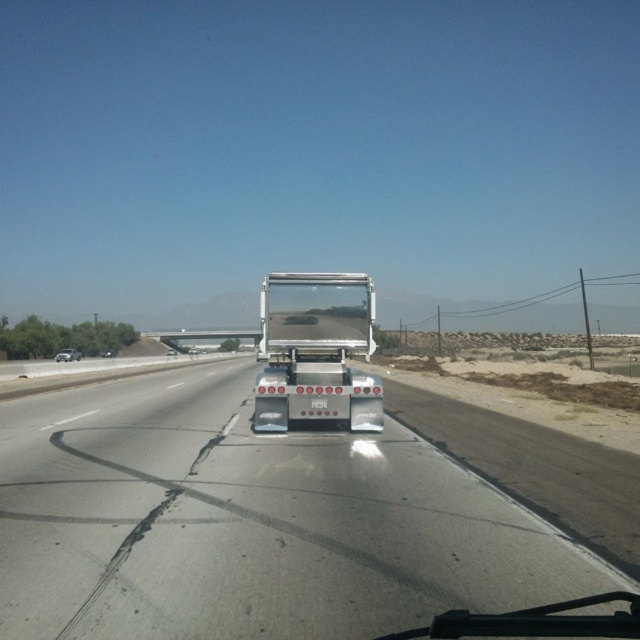
You are a passenger in the vehicle and want to see the silver metallic sedan at left through the transparent glass windshield at center. Can you see the entire sedan through the windshield?

The transparent glass windshield at center has a smaller size compared to silver metallic sedan at left, so you cannot see the entire sedan through the windshield.

You are a passenger in the vehicle and want to know if the point at coordinates point (x=369, y=323) is closer to you than the point at point (x=56, y=358). Can you determine this based on the scene?

Yes, the point at coordinates point (x=369, y=323) is closer to the camera than the point at point (x=56, y=358).